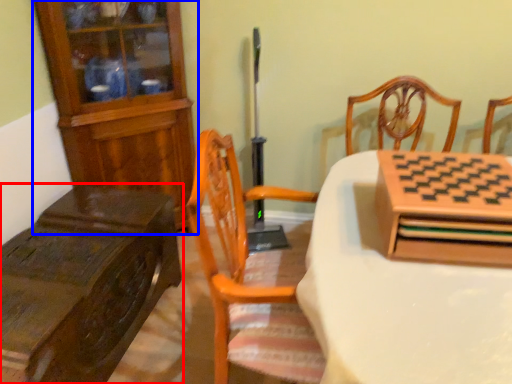
Question: Which object is further to the camera taking this photo, table (highlighted by a red box) or cabinetry (highlighted by a blue box)?

Choices:
 (A) table
 (B) cabinetry

Answer: (B)